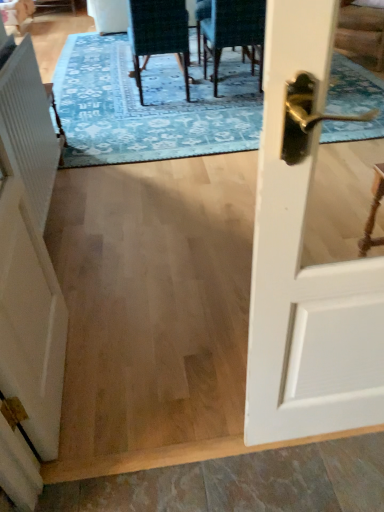
Identify the location of free space below velvet dark green chair at center, marked as the first chair in a left-to-right arrangement (from a real-world perspective). This screenshot has height=512, width=384. (162, 97).